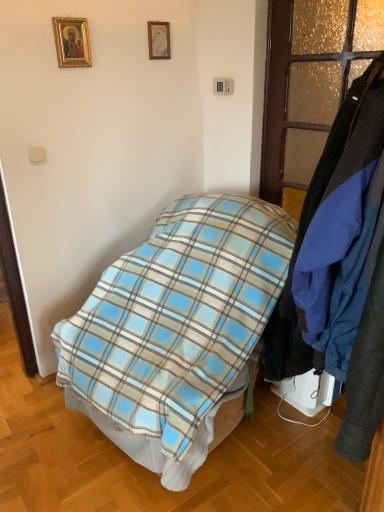
Question: Could gold-framed picture at upper left, arranged as the second picture frame when viewed from the right, be considered to be inside blue fabric coat at right?

Choices:
 (A) yes
 (B) no

Answer: (B)

Question: Does blue fabric coat at right have a lesser width compared to gold-framed picture at upper left, which ranks as the 1th picture frame in front-to-back order?

Choices:
 (A) yes
 (B) no

Answer: (B)

Question: From a real-world perspective, is blue fabric coat at right positioned under gold-framed picture at upper left, which ranks as the 1th picture frame in front-to-back order, based on gravity?

Choices:
 (A) no
 (B) yes

Answer: (B)

Question: Can you confirm if blue fabric coat at right is shorter than gold-framed picture at upper left, which ranks as the second picture frame in back-to-front order?

Choices:
 (A) yes
 (B) no

Answer: (B)

Question: From a real-world perspective, is blue fabric coat at right positioned over gold-framed picture at upper left, which ranks as the 1th picture frame in front-to-back order, based on gravity?

Choices:
 (A) no
 (B) yes

Answer: (A)

Question: Considering the positions of blue plaid blanket at center and matte gold picture frame at upper center, which appears as the second picture frame when viewed from the front, in the image, is blue plaid blanket at center taller or shorter than matte gold picture frame at upper center, which appears as the second picture frame when viewed from the front,?

Choices:
 (A) tall
 (B) short

Answer: (A)

Question: From a real-world perspective, is blue plaid blanket at center above or below matte gold picture frame at upper center, which is the 2th picture frame from left to right?

Choices:
 (A) below
 (B) above

Answer: (A)

Question: Based on their positions, is blue plaid blanket at center located to the left or right of matte gold picture frame at upper center, which is the 2th picture frame from left to right?

Choices:
 (A) right
 (B) left

Answer: (A)

Question: From the image's perspective, is blue plaid blanket at center positioned above or below matte gold picture frame at upper center, which is the 2th picture frame from left to right?

Choices:
 (A) above
 (B) below

Answer: (B)

Question: Considering the relative positions of textured gold glass door at right and blue plaid blanket at center in the image provided, is textured gold glass door at right to the left or to the right of blue plaid blanket at center?

Choices:
 (A) right
 (B) left

Answer: (A)

Question: Would you say textured gold glass door at right is inside or outside blue plaid blanket at center?

Choices:
 (A) outside
 (B) inside

Answer: (A)

Question: Considering the positions of point (306, 34) and point (165, 337), is point (306, 34) closer or farther from the camera than point (165, 337)?

Choices:
 (A) farther
 (B) closer

Answer: (A)

Question: In terms of width, does textured gold glass door at right look wider or thinner when compared to blue plaid blanket at center?

Choices:
 (A) wide
 (B) thin

Answer: (B)

Question: From the image's perspective, is matte gold picture frame at upper center, marked as the first picture frame in a right-to-left arrangement, located above or below gold-framed picture at upper left, acting as the first picture frame starting from the left?

Choices:
 (A) above
 (B) below

Answer: (A)

Question: Looking at the image, does matte gold picture frame at upper center, which appears as the first picture frame when viewed from the back, seem bigger or smaller compared to gold-framed picture at upper left, acting as the first picture frame starting from the left?

Choices:
 (A) small
 (B) big

Answer: (A)